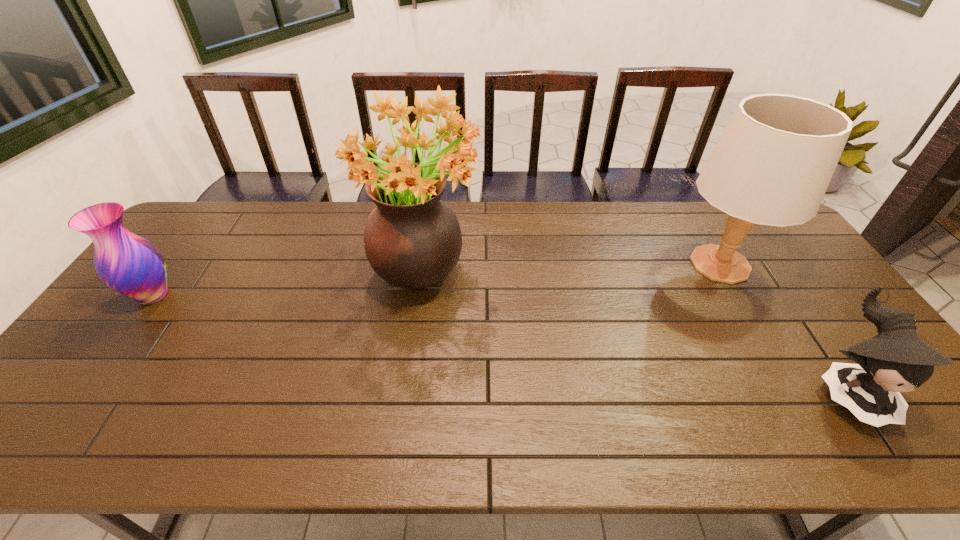
At what (x,y) coordinates should I click in order to perform the action: click on flower arrangement. Please return your answer as a coordinate pair (x, y). The image size is (960, 540). Looking at the image, I should click on (412, 239).

Find the location of `table lamp`. table lamp is located at coordinates (772, 165).

Where is `vase`? vase is located at coordinates (129, 264).

Image resolution: width=960 pixels, height=540 pixels. I want to click on the nearest object, so click(x=896, y=360).

In order to click on vacant space situated 0.230m on the front of the second object from left to right in this screenshot , I will do `click(408, 388)`.

Identify the location of free space located 0.050m on the back of the table lamp. The width and height of the screenshot is (960, 540). (697, 225).

Image resolution: width=960 pixels, height=540 pixels. Identify the location of free space located 0.080m on the right of the leftmost object. (206, 295).

Identify the location of flower arrangement positioned at the far edge. (412, 239).

In order to click on table lamp at the far edge in this screenshot , I will do `click(772, 165)`.

Where is `object positioned at the near edge`? object positioned at the near edge is located at coordinates (896, 360).